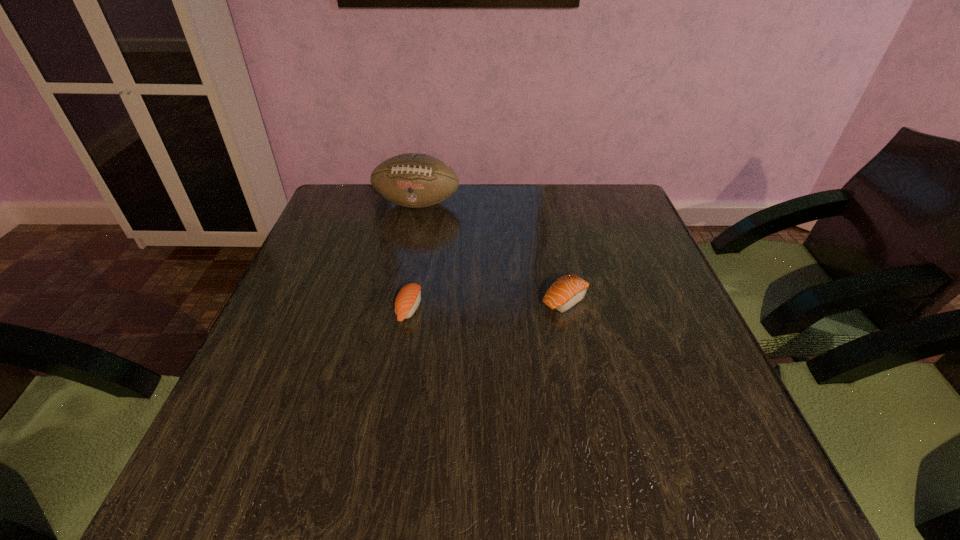
This screenshot has height=540, width=960. In order to click on vacant region that satisfies the following two spatial constraints: 1. on the laces of the rightmost object; 2. on the right side of the football (American) in this screenshot , I will do `click(398, 299)`.

Locate an element on the screen. The height and width of the screenshot is (540, 960). vacant space that satisfies the following two spatial constraints: 1. on the laces of the rightmost object; 2. on the left side of the tallest object is located at coordinates (398, 299).

Where is `vacant region that satisfies the following two spatial constraints: 1. on the laces of the farthest object; 2. on the left side of the left sushi`? The height and width of the screenshot is (540, 960). vacant region that satisfies the following two spatial constraints: 1. on the laces of the farthest object; 2. on the left side of the left sushi is located at coordinates (396, 309).

This screenshot has height=540, width=960. Identify the location of vacant region that satisfies the following two spatial constraints: 1. on the laces of the right sushi; 2. on the right side of the football (American). (398, 299).

I want to click on vacant area that satisfies the following two spatial constraints: 1. on the laces of the rightmost object; 2. on the right side of the football (American), so tap(398, 299).